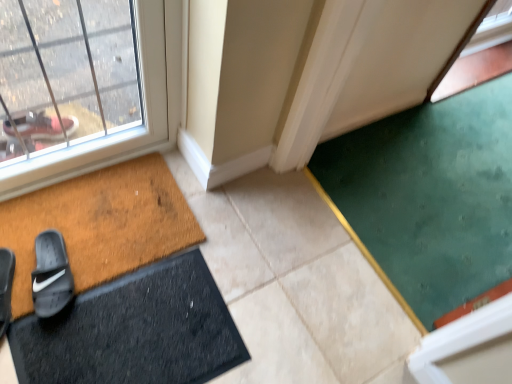
You are a GUI agent. You are given a task and a screenshot of the screen. Output one action in this format:
    pyautogui.click(x=<x>, y=<y>)
    Task: Click on the free space between brown textured doormat at lower left, which appears as the 1th bath mat when viewed from the top, and black rubber bath mat at lower left, positioned as the first bath mat in bottom-to-top order
    Image resolution: width=512 pixels, height=384 pixels.
    Given the screenshot: What is the action you would take?
    pyautogui.click(x=201, y=277)